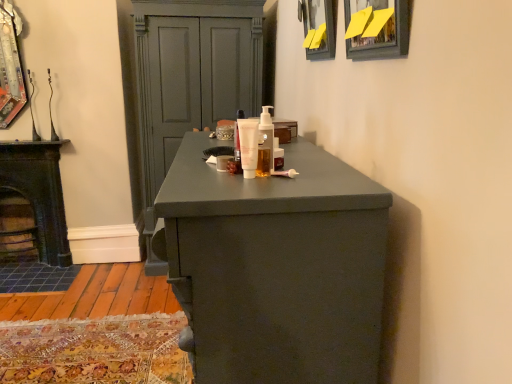
Question: From the image's perspective, is yellow paper at upper center, which appears as the 1th picture frame when viewed from the front, beneath white matte tube at center, the first mouthwash in the front-to-back sequence?

Choices:
 (A) no
 (B) yes

Answer: (A)

Question: Would you say white matte tube at center, marked as the 2th mouthwash in a back-to-front arrangement, is part of yellow paper at upper center, the second picture frame when ordered from back to front,'s contents?

Choices:
 (A) no
 (B) yes

Answer: (A)

Question: Is yellow paper at upper center, which appears as the 1th picture frame when viewed from the front, facing towards white matte tube at center, the first mouthwash in the front-to-back sequence?

Choices:
 (A) yes
 (B) no

Answer: (B)

Question: Does yellow paper at upper center, the second picture frame when ordered from back to front, lie in front of white matte tube at center, marked as the 2th mouthwash in a back-to-front arrangement?

Choices:
 (A) no
 (B) yes

Answer: (B)

Question: Is yellow paper at upper center, which appears as the 1th picture frame when viewed from the front, directly adjacent to white matte tube at center, marked as the 2th mouthwash in a back-to-front arrangement?

Choices:
 (A) yes
 (B) no

Answer: (B)

Question: Is yellow paper at upper center, the second picture frame when ordered from back to front, outside of white matte tube at center, the first mouthwash in the front-to-back sequence?

Choices:
 (A) yes
 (B) no

Answer: (A)

Question: Can you confirm if white matte tube at center is thinner than matte gray cupboard at center?

Choices:
 (A) yes
 (B) no

Answer: (A)

Question: From a real-world perspective, is white matte tube at center physically above matte gray cupboard at center?

Choices:
 (A) no
 (B) yes

Answer: (B)

Question: Would you say white matte tube at center is outside matte gray cupboard at center?

Choices:
 (A) yes
 (B) no

Answer: (A)

Question: Is white matte tube at center closer to camera compared to matte gray cupboard at center?

Choices:
 (A) no
 (B) yes

Answer: (B)

Question: Is white matte tube at center looking in the opposite direction of matte gray cupboard at center?

Choices:
 (A) yes
 (B) no

Answer: (B)

Question: From a real-world perspective, is white matte tube at center beneath matte gray cupboard at center?

Choices:
 (A) yes
 (B) no

Answer: (B)

Question: From a real-world perspective, is white matte tube at center, marked as the 2th mouthwash in a back-to-front arrangement, located higher than matte black picture frame at upper center, which is the first picture frame from back to front?

Choices:
 (A) no
 (B) yes

Answer: (A)